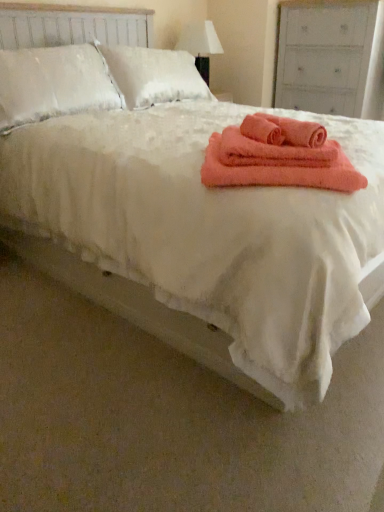
This screenshot has height=512, width=384. Describe the element at coordinates (272, 152) in the screenshot. I see `coral fuzzy bath towel at center, which is the 2th bath towel from right to left` at that location.

Locate an element on the screen. white painted wood dresser at upper right is located at coordinates (330, 57).

In order to face white fabric lampshade at upper center, should I rotate leftwards or rightwards?

You should rotate right by 1.883 degrees.

The image size is (384, 512). What do you see at coordinates (263, 129) in the screenshot?
I see `coral soft towel at center, placed as the 1th bath towel when sorted from left to right` at bounding box center [263, 129].

What are the coordinates of `coral soft towel at center` in the screenshot? It's located at (279, 172).

Between white fabric lampshade at upper center and coral fuzzy bath towel at center, acting as the 1th bath towel starting from the right, which one appears on the left side from the viewer's perspective?

white fabric lampshade at upper center is more to the left.

Is white fabric lampshade at upper center facing towards coral fuzzy bath towel at center, the 3th bath towel when ordered from left to right?

No, white fabric lampshade at upper center does not turn towards coral fuzzy bath towel at center, the 3th bath towel when ordered from left to right.

Considering the positions of objects white fabric lampshade at upper center and coral fuzzy bath towel at center, acting as the 1th bath towel starting from the right, in the image provided, who is behind, white fabric lampshade at upper center or coral fuzzy bath towel at center, acting as the 1th bath towel starting from the right,?

white fabric lampshade at upper center is more distant.

Does coral fuzzy bath towel at center, which is the 2th bath towel from right to left, have a greater height compared to white fabric lampshade at upper center?

No.

From a real-world perspective, is coral fuzzy bath towel at center, which appears as the second bath towel when viewed from the left, physically above white fabric lampshade at upper center?

Actually, coral fuzzy bath towel at center, which appears as the second bath towel when viewed from the left, is physically below white fabric lampshade at upper center in the real world.

Is point (325, 145) farther from camera compared to point (209, 35)?

No, it is in front of (209, 35).

Considering the relative positions of coral fuzzy bath towel at center, acting as the 1th bath towel starting from the right, and white fabric lampshade at upper center in the image provided, is coral fuzzy bath towel at center, acting as the 1th bath towel starting from the right, to the left or to the right of white fabric lampshade at upper center?

coral fuzzy bath towel at center, acting as the 1th bath towel starting from the right, is positioned on white fabric lampshade at upper center's right side.

Who is shorter, coral fuzzy bath towel at center, the 3th bath towel when ordered from left to right, or white fabric lampshade at upper center?

With less height is coral fuzzy bath towel at center, the 3th bath towel when ordered from left to right.

Based on the photo, is coral fuzzy bath towel at center, the 3th bath towel when ordered from left to right, oriented away from white fabric lampshade at upper center?

No, coral fuzzy bath towel at center, the 3th bath towel when ordered from left to right, is not facing the opposite direction of white fabric lampshade at upper center.

From the image's perspective, which one is positioned higher, coral fuzzy bath towel at center, the 3th bath towel when ordered from left to right, or white fabric lampshade at upper center?

white fabric lampshade at upper center, from the image's perspective.

Can you confirm if white painted wood dresser at upper right is positioned to the left of coral fuzzy bath towel at center, the 3th bath towel when ordered from left to right?

Incorrect, white painted wood dresser at upper right is not on the left side of coral fuzzy bath towel at center, the 3th bath towel when ordered from left to right.

Which is closer to the camera, (x=345, y=79) or (x=249, y=131)?

Point (x=345, y=79).

Is white painted wood dresser at upper right far away from coral fuzzy bath towel at center, the 3th bath towel when ordered from left to right?

Yes, white painted wood dresser at upper right is far from coral fuzzy bath towel at center, the 3th bath towel when ordered from left to right.

From their relative heights in the image, would you say white painted wood dresser at upper right is taller or shorter than coral fuzzy bath towel at center, the 3th bath towel when ordered from left to right?

In the image, white painted wood dresser at upper right appears to be taller than coral fuzzy bath towel at center, the 3th bath towel when ordered from left to right.

From a real-world perspective, which object stands above the other?

white fabric lampshade at upper center is physically above.

Choose the correct answer: Is white fabric lampshade at upper center inside coral soft towel at center, placed as the 1th bath towel when sorted from left to right, or outside it?

white fabric lampshade at upper center is not enclosed by coral soft towel at center, placed as the 1th bath towel when sorted from left to right.

From a real-world perspective, starting from the white fabric lampshade at upper center, which bath towel is the 2nd one below it? Please provide its 2D coordinates.

[(263, 129)]

Is white fabric lampshade at upper center oriented away from coral soft towel at center, placed as the 1th bath towel when sorted from left to right?

No, coral soft towel at center, placed as the 1th bath towel when sorted from left to right, is not at the back of white fabric lampshade at upper center.

Based on their sizes in the image, would you say coral soft towel at center is bigger or smaller than coral fuzzy bath towel at center, the 3th bath towel when ordered from left to right?

coral soft towel at center is bigger than coral fuzzy bath towel at center, the 3th bath towel when ordered from left to right.

From the image's perspective, between coral soft towel at center and coral fuzzy bath towel at center, acting as the 1th bath towel starting from the right, who is located below?

From the image's view, coral soft towel at center is below.

Is coral soft towel at center oriented towards coral fuzzy bath towel at center, the 3th bath towel when ordered from left to right?

No.

Which is in front, coral soft towel at center or coral fuzzy bath towel at center, acting as the 1th bath towel starting from the right?

coral soft towel at center is more forward.

Is white fabric lampshade at upper center positioned with its back to coral fuzzy bath towel at center, which is the 2th bath towel from right to left?

That's not correct — white fabric lampshade at upper center is not looking away from coral fuzzy bath towel at center, which is the 2th bath towel from right to left.

Is white fabric lampshade at upper center at the left side of coral fuzzy bath towel at center, which is the 2th bath towel from right to left?

Yes.

Which point is more distant from viewer, (201, 24) or (237, 137)?

The point (201, 24) is farther.

In the scene shown: Is white fabric lampshade at upper center positioned before coral fuzzy bath towel at center, which appears as the second bath towel when viewed from the left?

No, it is behind coral fuzzy bath towel at center, which appears as the second bath towel when viewed from the left.

Identify the location of table lamp behind the coral fuzzy bath towel at center, acting as the 1th bath towel starting from the right. (200, 45).

Find the location of a particular element. bath towel that is the 3rd one when counting downward from the white fabric lampshade at upper center (from the image's perspective) is located at coordinates (272, 152).

Looking at the image, which one is located closer to white painted wood dresser at upper right, coral fuzzy bath towel at center, which appears as the second bath towel when viewed from the left, or coral soft towel at center, placed as the 1th bath towel when sorted from left to right?

coral soft towel at center, placed as the 1th bath towel when sorted from left to right, is positioned closer to the anchor white painted wood dresser at upper right.

Based on their spatial positions, is coral fuzzy bath towel at center, which appears as the second bath towel when viewed from the left, or white painted wood dresser at upper right closer to coral soft towel at center, placed as the 1th bath towel when sorted from left to right?

coral fuzzy bath towel at center, which appears as the second bath towel when viewed from the left, is positioned closer to the anchor coral soft towel at center, placed as the 1th bath towel when sorted from left to right.

Considering their positions, is coral fuzzy bath towel at center, which is the 2th bath towel from right to left, positioned closer to white fabric lampshade at upper center than coral soft towel at center, placed as the 1th bath towel when sorted from left to right?

The object closer to white fabric lampshade at upper center is coral soft towel at center, placed as the 1th bath towel when sorted from left to right.

From the image, which object appears to be farther from coral soft towel at center, white fabric lampshade at upper center or coral soft towel at center, placed as the 1th bath towel when sorted from left to right?

Among the two, white fabric lampshade at upper center is located further to coral soft towel at center.

Estimate the real-world distances between objects in this image. Which object is closer to coral fuzzy bath towel at center, the 3th bath towel when ordered from left to right, coral soft towel at center or white painted wood dresser at upper right?

coral soft towel at center.

From the image, which object appears to be farther from coral soft towel at center, placed as the 1th bath towel when sorted from left to right, coral fuzzy bath towel at center, which is the 2th bath towel from right to left, or coral soft towel at center?

Among the two, coral soft towel at center is located further to coral soft towel at center, placed as the 1th bath towel when sorted from left to right.

Looking at the image, which one is located closer to coral soft towel at center, placed as the 1th bath towel when sorted from left to right, coral soft towel at center or white painted wood dresser at upper right?

coral soft towel at center lies closer to coral soft towel at center, placed as the 1th bath towel when sorted from left to right, than the other object.

Which object lies nearer to the anchor point white painted wood dresser at upper right, white fabric lampshade at upper center or coral soft towel at center, positioned as the 3th bath towel in right-to-left order?

The object closer to white painted wood dresser at upper right is white fabric lampshade at upper center.

Identify the location of dresser positioned between coral soft towel at center and white fabric lampshade at upper center from near to far. (330, 57).

Where is `dresser between coral fuzzy bath towel at center, the 3th bath towel when ordered from left to right, and white fabric lampshade at upper center in the front-back direction`? Image resolution: width=384 pixels, height=512 pixels. dresser between coral fuzzy bath towel at center, the 3th bath towel when ordered from left to right, and white fabric lampshade at upper center in the front-back direction is located at coordinates (330, 57).

Where is `dresser between coral fuzzy bath towel at center, which appears as the second bath towel when viewed from the left, and white fabric lampshade at upper center, along the z-axis`? This screenshot has width=384, height=512. dresser between coral fuzzy bath towel at center, which appears as the second bath towel when viewed from the left, and white fabric lampshade at upper center, along the z-axis is located at coordinates (330, 57).

You are a GUI agent. You are given a task and a screenshot of the screen. Output one action in this format:
    pyautogui.click(x=<x>, y=<y>)
    Task: Click on the bath towel situated between coral soft towel at center, positioned as the 3th bath towel in right-to-left order, and coral fuzzy bath towel at center, the 3th bath towel when ordered from left to right, from left to right
    Image resolution: width=384 pixels, height=512 pixels.
    Given the screenshot: What is the action you would take?
    pyautogui.click(x=272, y=152)